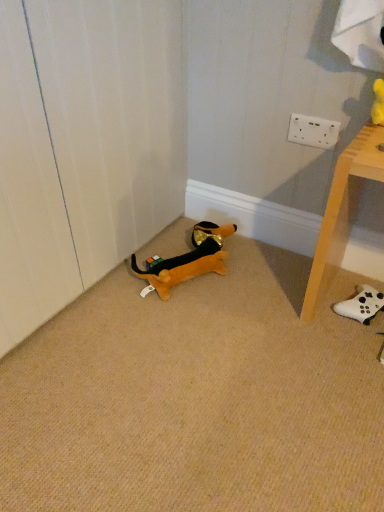
Question: Is white matte controller at lower right, the 2th toy viewed from the left, smaller than white wood table at lower right?

Choices:
 (A) yes
 (B) no

Answer: (A)

Question: Is white matte controller at lower right, the 2th toy viewed from the left, not inside white wood table at lower right?

Choices:
 (A) yes
 (B) no

Answer: (B)

Question: From a real-world perspective, is white matte controller at lower right, the 2th toy viewed from the left, positioned over white wood table at lower right based on gravity?

Choices:
 (A) yes
 (B) no

Answer: (B)

Question: Are white matte controller at lower right, the 2th toy viewed from the left, and white wood table at lower right making contact?

Choices:
 (A) yes
 (B) no

Answer: (B)

Question: Is white matte controller at lower right, which appears as the 1th toy when viewed from the right, at the left side of white wood table at lower right?

Choices:
 (A) no
 (B) yes

Answer: (A)

Question: Is white wood table at lower right located within white matte controller at lower right, the 2th toy viewed from the left?

Choices:
 (A) yes
 (B) no

Answer: (B)

Question: From a real-world perspective, is soft plush dog at lower left, which is the second toy from right to left, below white wood table at lower right?

Choices:
 (A) no
 (B) yes

Answer: (B)

Question: Is there a large distance between soft plush dog at lower left, the 1th toy in the left-to-right sequence, and white wood table at lower right?

Choices:
 (A) no
 (B) yes

Answer: (A)

Question: Considering the relative positions of soft plush dog at lower left, the 1th toy in the left-to-right sequence, and white wood table at lower right in the image provided, is soft plush dog at lower left, the 1th toy in the left-to-right sequence, to the left of white wood table at lower right from the viewer's perspective?

Choices:
 (A) yes
 (B) no

Answer: (A)

Question: Is white wood table at lower right at the back of soft plush dog at lower left, which is the second toy from right to left?

Choices:
 (A) yes
 (B) no

Answer: (B)

Question: From a real-world perspective, is soft plush dog at lower left, which is the second toy from right to left, positioned over white wood table at lower right based on gravity?

Choices:
 (A) no
 (B) yes

Answer: (A)

Question: From the image's perspective, is soft plush dog at lower left, the 1th toy in the left-to-right sequence, under white wood table at lower right?

Choices:
 (A) yes
 (B) no

Answer: (A)

Question: From a real-world perspective, is white wood table at lower right below soft plush dog at lower left, which is the second toy from right to left?

Choices:
 (A) no
 (B) yes

Answer: (A)